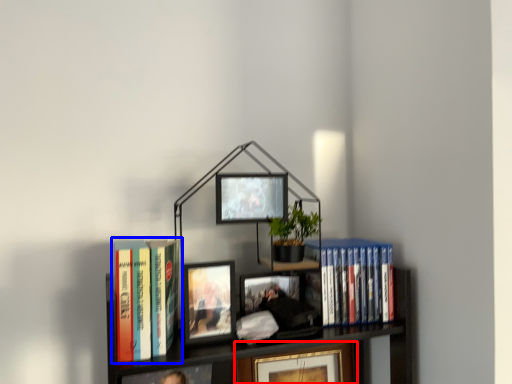
Question: Which object is closer to the camera taking this photo, picture frame (highlighted by a red box) or book (highlighted by a blue box)?

Choices:
 (A) picture frame
 (B) book

Answer: (B)